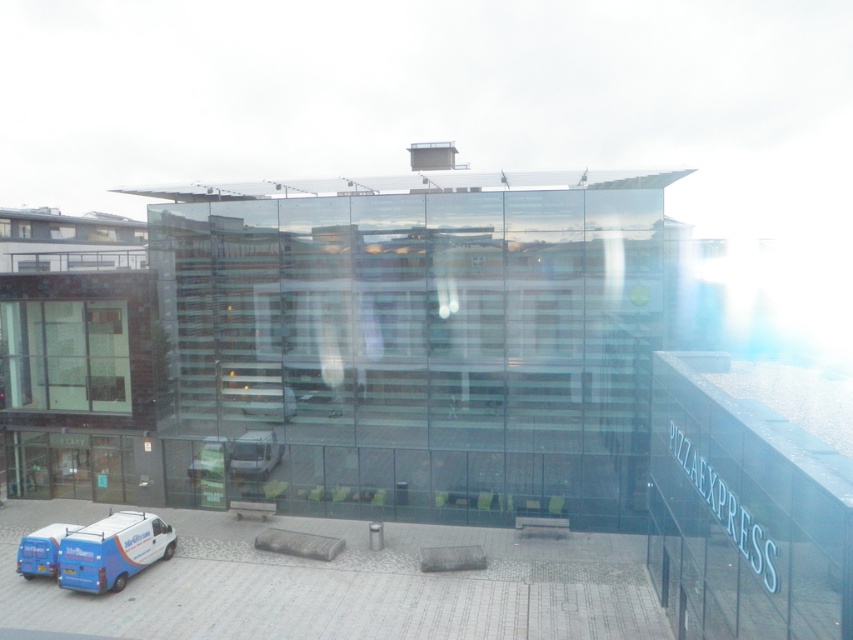
Based on the photo, you are a delivery driver approaching the building and need to park your vehicle. You see the white matte van at center and the blue metallic van at center. Which van is closer to you, and can you park behind it without blocking the other?

The white matte van at center is closer to you. Since it is closer, you can park behind it without blocking the blue metallic van at center, which is further back.

You are a delivery driver trying to park your truck, which is 2.5 meters wide, in the parking lot near the modern glass building. You see the white matte van at center and the blue metallic van at center parked there. Can you determine if there is enough space between them to park your truck?

The white matte van at center might be wider than blue metallic van at center. If the white matte van at center is indeed wider, the space between them may not be sufficient for your 2.5 meter wide truck. However, if it is narrower, there might be enough space. Without exact measurements, it is uncertain.

You are standing in front of the modern glass building and want to park your white matte van at center. The parking spot is located at coordinates point (236, 456). Can you confirm if the van is already parked there?

The point (236, 456) indicates the white matte van at center is already parked there.